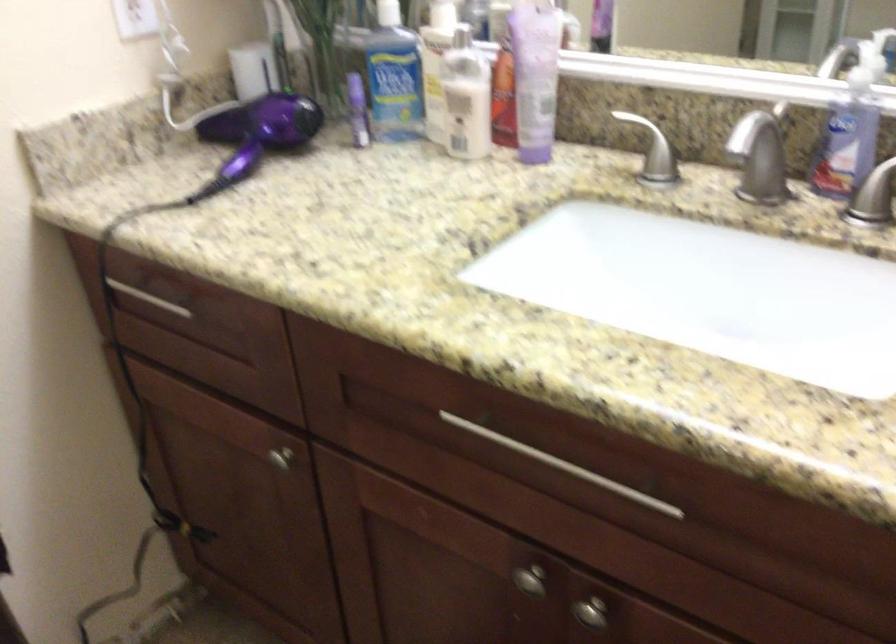
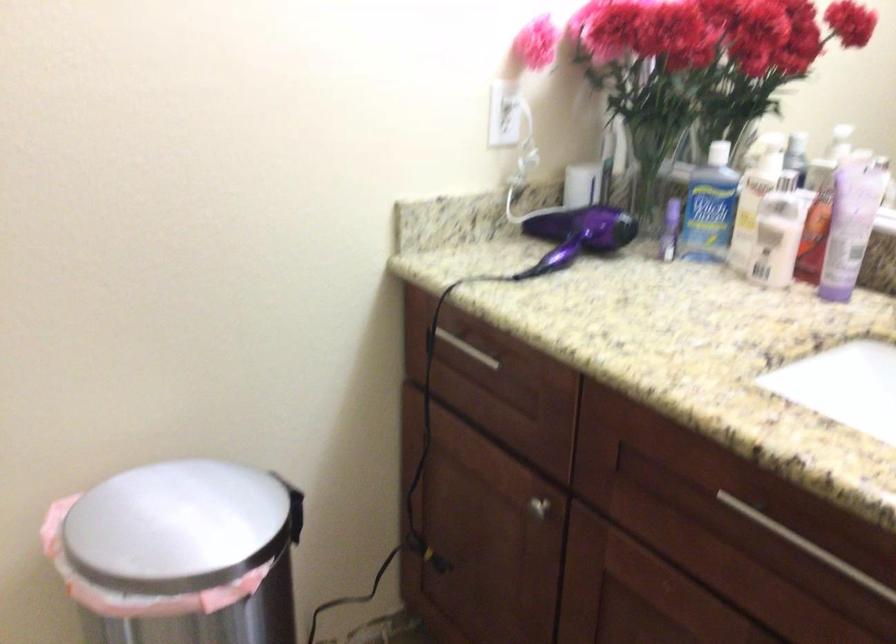
Question: The first image is from the beginning of the video and the second image is from the end. How did the camera likely rotate when shooting the video?

Choices:
 (A) Left
 (B) Right
 (C) Up
 (D) Down

Answer: (A)